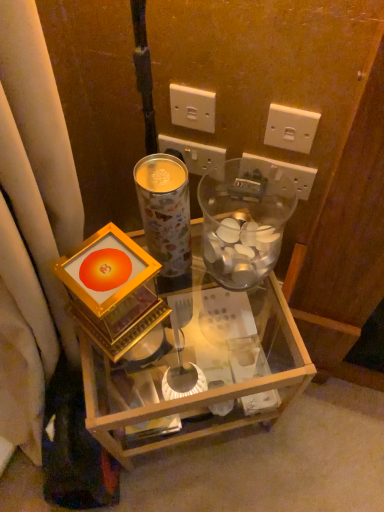
Where is `gold metallic frame at center`? This screenshot has height=512, width=384. gold metallic frame at center is located at coordinates (217, 361).

What do you see at coordinates (193, 153) in the screenshot?
I see `white plastic power outlet at upper center, the 3th power outlet viewed from the right` at bounding box center [193, 153].

Describe the element at coordinates (165, 210) in the screenshot. I see `metallic floral-patterned coffee cup at center` at that location.

The image size is (384, 512). In order to click on transparent glass jar at center-right in this screenshot , I will do `click(244, 220)`.

This screenshot has height=512, width=384. Identify the location of gold metallic frame at center. (217, 361).

Locate an element on the screen. This screenshot has height=512, width=384. desk lying on the right of metallic floral-patterned coffee cup at center is located at coordinates (217, 361).

Is metallic floral-patterned coffee cup at center situated inside gold metallic frame at center or outside?

metallic floral-patterned coffee cup at center is not inside gold metallic frame at center, it's outside.

Is metallic floral-patterned coffee cup at center oriented towards gold metallic frame at center?

No, metallic floral-patterned coffee cup at center is not aimed at gold metallic frame at center.

How distant is metallic floral-patterned coffee cup at center from gold metallic frame at center?

metallic floral-patterned coffee cup at center is 8.31 inches from gold metallic frame at center.

Image resolution: width=384 pixels, height=512 pixels. I want to click on coffee cup beneath the white plastic power outlet at upper right, the fourth power outlet from the left (from a real-world perspective), so click(165, 210).

Is point (293, 125) closer or farther from the camera than point (147, 241)?

Point (293, 125) is farther from the camera than point (147, 241).

Looking at this image, is white plastic power outlet at upper right, the fourth power outlet from the left, wider than metallic floral-patterned coffee cup at center?

No.

Between metallic floral-patterned coffee cup at center and white plastic power outlet at upper center, which is counted as the fourth power outlet, starting from the right, which one has smaller width?

white plastic power outlet at upper center, which is counted as the fourth power outlet, starting from the right.

Is point (167, 168) closer or farther from the camera than point (200, 106)?

Point (167, 168).

Considering the sizes of metallic floral-patterned coffee cup at center and white plastic power outlet at upper center, placed as the 1th power outlet when sorted from left to right, in the image, is metallic floral-patterned coffee cup at center taller or shorter than white plastic power outlet at upper center, placed as the 1th power outlet when sorted from left to right,?

Clearly, metallic floral-patterned coffee cup at center is taller compared to white plastic power outlet at upper center, placed as the 1th power outlet when sorted from left to right.

Is metallic floral-patterned coffee cup at center completely or partially inside black plastic power outlet at upper right, the third power outlet from the left?

No.

Is black plastic power outlet at upper right, positioned as the second power outlet in right-to-left order, not near metallic floral-patterned coffee cup at center?

Actually, black plastic power outlet at upper right, positioned as the second power outlet in right-to-left order, and metallic floral-patterned coffee cup at center are a little close together.

Which is closer, [297,188] or [181,249]?

Point [297,188] is closer to the camera than point [181,249].

In the scene shown: Is black plastic power outlet at upper right, positioned as the second power outlet in right-to-left order, oriented towards metallic floral-patterned coffee cup at center?

Yes, black plastic power outlet at upper right, positioned as the second power outlet in right-to-left order, faces towards metallic floral-patterned coffee cup at center.

Is black plastic power outlet at upper right, the third power outlet from the left, positioned behind transparent glass jar at center-right?

Yes, black plastic power outlet at upper right, the third power outlet from the left, is further from the camera.

Considering the relative sizes of black plastic power outlet at upper right, positioned as the second power outlet in right-to-left order, and transparent glass jar at center-right in the image provided, is black plastic power outlet at upper right, positioned as the second power outlet in right-to-left order, taller than transparent glass jar at center-right?

No.

Can you confirm if black plastic power outlet at upper right, positioned as the second power outlet in right-to-left order, is wider than transparent glass jar at center-right?

No.

Between white plastic power outlet at upper right, acting as the 1th power outlet starting from the right, and black plastic power outlet at upper right, positioned as the second power outlet in right-to-left order, which one has less height?

black plastic power outlet at upper right, positioned as the second power outlet in right-to-left order.

Is point (305, 153) less distant than point (307, 167)?

Yes, it is in front of point (307, 167).

You are a GUI agent. You are given a task and a screenshot of the screen. Output one action in this format:
    pyautogui.click(x=<x>, y=<y>)
    Task: Click on the power outlet lying on the right of black plastic power outlet at upper right, the third power outlet from the left
    The image size is (384, 512).
    Given the screenshot: What is the action you would take?
    (x=291, y=128)

Is metallic floral-patterned coffee cup at center not within white plastic power outlet at upper center, acting as the second power outlet starting from the left?

metallic floral-patterned coffee cup at center lies outside white plastic power outlet at upper center, acting as the second power outlet starting from the left,'s area.

Between metallic floral-patterned coffee cup at center and white plastic power outlet at upper center, acting as the second power outlet starting from the left, which one has larger width?

Wider between the two is metallic floral-patterned coffee cup at center.

Is the position of metallic floral-patterned coffee cup at center more distant than that of white plastic power outlet at upper center, acting as the second power outlet starting from the left?

No, metallic floral-patterned coffee cup at center is closer to the camera.

From the image's perspective, between metallic floral-patterned coffee cup at center and white plastic power outlet at upper center, the 3th power outlet viewed from the right, who is located below?

From the image's view, metallic floral-patterned coffee cup at center is below.

The image size is (384, 512). In order to click on coffee cup lying above the gold metallic frame at center (from the image's perspective) in this screenshot , I will do `click(165, 210)`.

Identify the location of coffee cup beneath the white plastic power outlet at upper right, the fourth power outlet from the left (from a real-world perspective). (165, 210).

Based on their spatial positions, is white plastic power outlet at upper right, acting as the 1th power outlet starting from the right, or metallic floral-patterned coffee cup at center further from white plastic power outlet at upper center, acting as the second power outlet starting from the left?

Among the two, metallic floral-patterned coffee cup at center is located further to white plastic power outlet at upper center, acting as the second power outlet starting from the left.

From the image, which object appears to be farther from white plastic power outlet at upper center, placed as the 1th power outlet when sorted from left to right, white plastic power outlet at upper right, acting as the 1th power outlet starting from the right, or gold metallic frame at center?

The object further to white plastic power outlet at upper center, placed as the 1th power outlet when sorted from left to right, is gold metallic frame at center.

Considering their positions, is transparent glass jar at center-right positioned closer to black plastic power outlet at upper right, the third power outlet from the left, than white plastic power outlet at upper right, acting as the 1th power outlet starting from the right?

white plastic power outlet at upper right, acting as the 1th power outlet starting from the right, lies closer to black plastic power outlet at upper right, the third power outlet from the left, than the other object.

Looking at the image, which one is located further to white plastic power outlet at upper right, the fourth power outlet from the left, metallic floral-patterned coffee cup at center or gold metallic frame at center?

gold metallic frame at center is further to white plastic power outlet at upper right, the fourth power outlet from the left.

Estimate the real-world distances between objects in this image. Which object is further from black plastic power outlet at upper right, the third power outlet from the left, white plastic power outlet at upper center, placed as the 1th power outlet when sorted from left to right, or metallic floral-patterned coffee cup at center?

metallic floral-patterned coffee cup at center is further to black plastic power outlet at upper right, the third power outlet from the left.

Estimate the real-world distances between objects in this image. Which object is further from black plastic power outlet at upper right, positioned as the second power outlet in right-to-left order, gold metallic frame at center or white plastic power outlet at upper center, acting as the second power outlet starting from the left?

Based on the image, gold metallic frame at center appears to be further to black plastic power outlet at upper right, positioned as the second power outlet in right-to-left order.

Looking at the image, which one is located closer to white plastic power outlet at upper right, acting as the 1th power outlet starting from the right, black plastic power outlet at upper right, positioned as the second power outlet in right-to-left order, or gold metallic frame at center?

The object closer to white plastic power outlet at upper right, acting as the 1th power outlet starting from the right, is black plastic power outlet at upper right, positioned as the second power outlet in right-to-left order.

Which object lies nearer to the anchor point black plastic power outlet at upper right, the third power outlet from the left, transparent glass jar at center-right or white plastic power outlet at upper center, which is counted as the fourth power outlet, starting from the right?

Based on the image, transparent glass jar at center-right appears to be nearer to black plastic power outlet at upper right, the third power outlet from the left.

Locate an element on the screen. Image resolution: width=384 pixels, height=512 pixels. glass jar that lies between black plastic power outlet at upper right, the third power outlet from the left, and gold metallic frame at center from top to bottom is located at coordinates (244, 220).

Where is `coffee cup between white plastic power outlet at upper center, placed as the 1th power outlet when sorted from left to right, and transparent glass jar at center-right in the up-down direction`? The height and width of the screenshot is (512, 384). coffee cup between white plastic power outlet at upper center, placed as the 1th power outlet when sorted from left to right, and transparent glass jar at center-right in the up-down direction is located at coordinates (165, 210).

Identify the location of coffee cup between white plastic power outlet at upper right, acting as the 1th power outlet starting from the right, and gold metallic frame at center in the up-down direction. (165, 210).

Locate an element on the screen. coffee cup between white plastic power outlet at upper center, the 3th power outlet viewed from the right, and gold metallic frame at center from top to bottom is located at coordinates (165, 210).